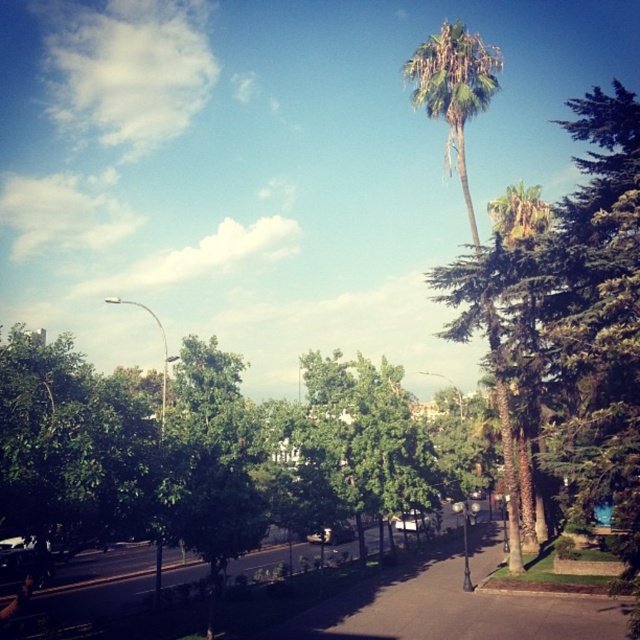
Question: Among these points, which one is nearest to the camera?

Choices:
 (A) coord(563,285)
 (B) coord(512,484)

Answer: (A)

Question: In this image, where is green leafy tree at upper right located relative to green leafy palm tree at center?

Choices:
 (A) left
 (B) right

Answer: (B)

Question: Does green leafy tree at upper right appear on the left side of green leafy palm tree at center?

Choices:
 (A) yes
 (B) no

Answer: (B)

Question: Does green leafy tree at upper right have a smaller size compared to green leafy palm tree at center?

Choices:
 (A) yes
 (B) no

Answer: (B)

Question: Which point appears farthest from the camera in this image?

Choices:
 (A) (467, 314)
 (B) (458, 152)

Answer: (B)